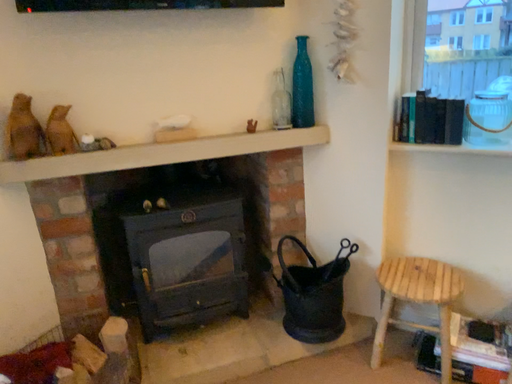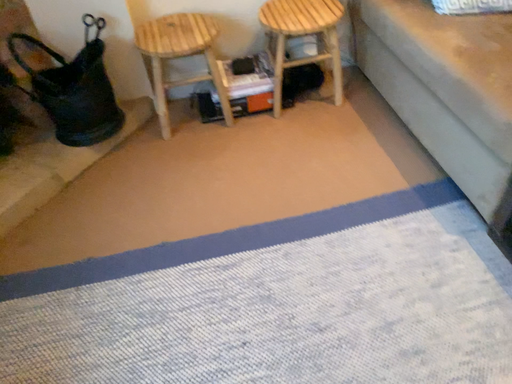
Question: How did the camera likely rotate when shooting the video?

Choices:
 (A) rotated downward
 (B) rotated upward

Answer: (A)